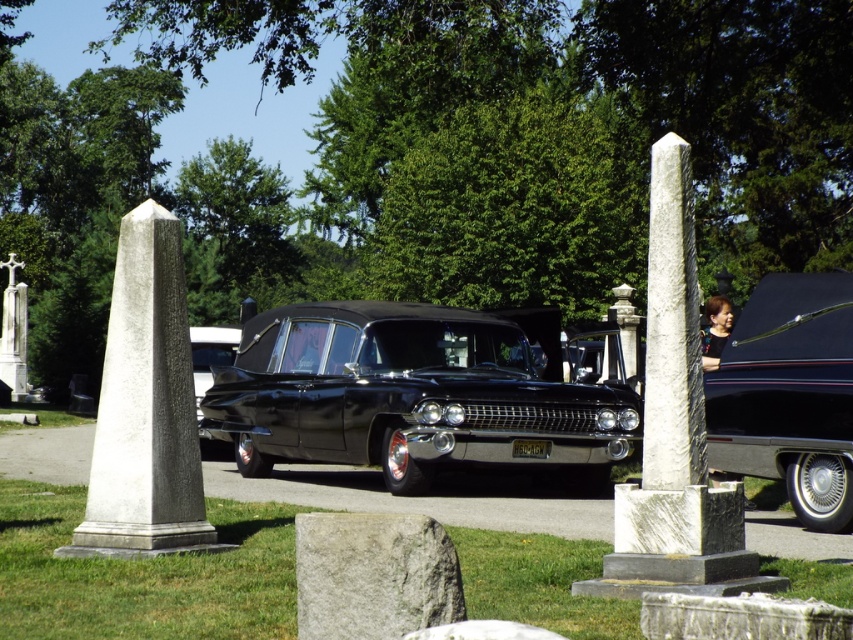
Consider the image. You are a groundskeeper tasked with mowing the lawn between the gray marble obelisk at center and the white marble cross at center. Which object should you avoid mowing around first based on their spatial relationship?

The gray marble obelisk at center is positioned over the white marble cross at center, so you should avoid mowing around the gray marble obelisk at center first as it is above the white marble cross at center.

You are standing at the point closer to the camera in this cemetery scene. Which point are you standing at, point (846, 291) or point (679, 236)?

You are standing at point (846, 291) because it is further to the camera than point (679, 236).

You are a photographer planning to take a picture of the black glossy hearse at center and the white marble cross at center. Which object should you position to the left side of your photo to include both in the frame?

You should position the white marble cross at center on the left side of your photo because the black glossy hearse at center is to the right of it, ensuring both are included in the frame.